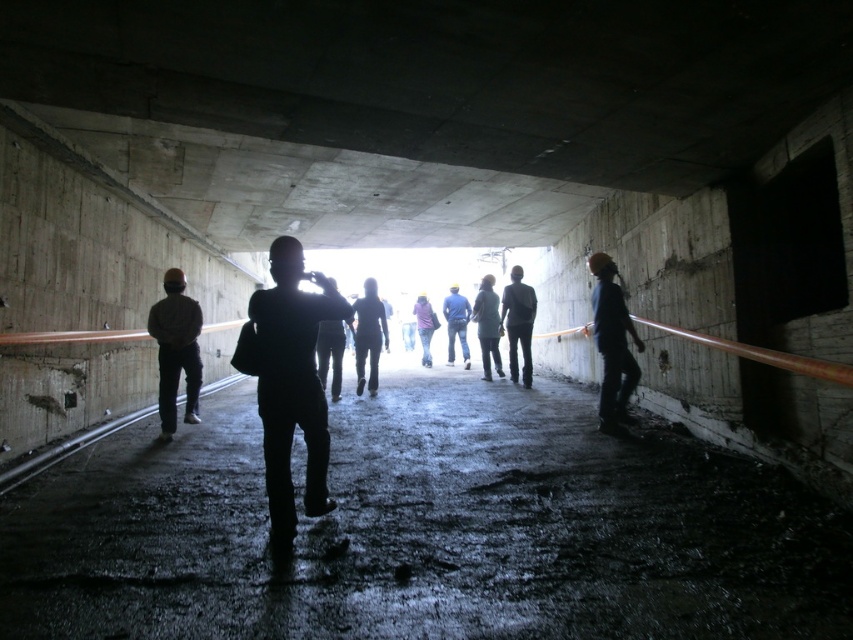
You are a safety inspector checking the tunnel for proper equipment usage. You notice the hard hat at right and the dark blue fabric jacket at center. Which object is shorter in height?

The hard hat at right has a lesser height compared to the dark blue fabric jacket at center, so the hard hat at right is shorter.

You are standing at the entrance of the tunnel and see the silhouette jacket at center and the purple fabric jacket at center. Which one is closer to the exit?

The silhouette jacket at center is to the left of the purple fabric jacket at center. Since the group is heading towards the exit at the far end, the silhouette jacket at center is closer to the exit than the purple fabric jacket at center because it is positioned to the left, which is the direction they are moving towards.

You are a delivery person carrying a box that is 10 feet long. You are in the tunnel and need to pass between the silhouette jacket at center and the purple fabric jacket at center. Can your box fit through the space between them?

The silhouette jacket at center is 15.35 feet from the purple fabric jacket at center. Since the box is 10 feet long, it can fit through the space between them as the distance is greater than the box length.